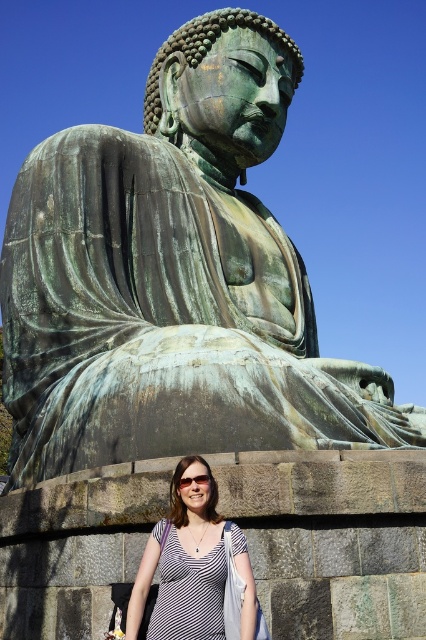
You are a photographer trying to capture a photo of the seated Buddha statue. There is a person wearing a white striped shirt at lower center in the frame. Where should you adjust your camera to exclude the person from the photo?

To exclude the person wearing the white striped shirt at lower center, adjust the camera upwards since the shirt is positioned at point 0.883 on the x and 0.432 on the y axis, which is lower in the frame. By tilting the camera upwards, you can frame the shot to focus on the upper areas where the statue is located without including the lower section where the person stands.

You are standing in front of the seated Buddha statue. There is a point marked at coordinates (184, 564). What object is located at that point?

The white striped shirt at lower center is located at point (184, 564).

You are a photographer trying to capture the person in front of the seated Buddha statue. The person is wearing a white striped shirt at lower center and transparent plastic goggles at center. Which item has a smaller width?

The white striped shirt at lower center has a smaller width than the transparent plastic goggles at center.